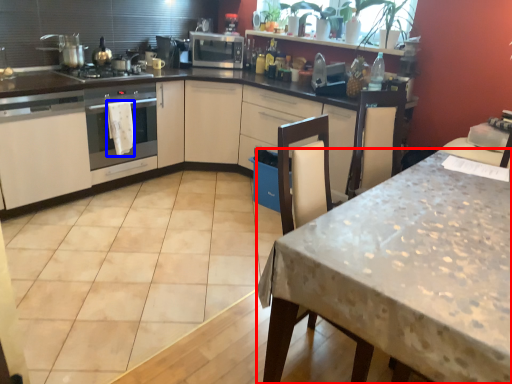
Question: Which of the following is the closest to the observer, table (highlighted by a red box) or blanket (highlighted by a blue box)?

Choices:
 (A) table
 (B) blanket

Answer: (A)